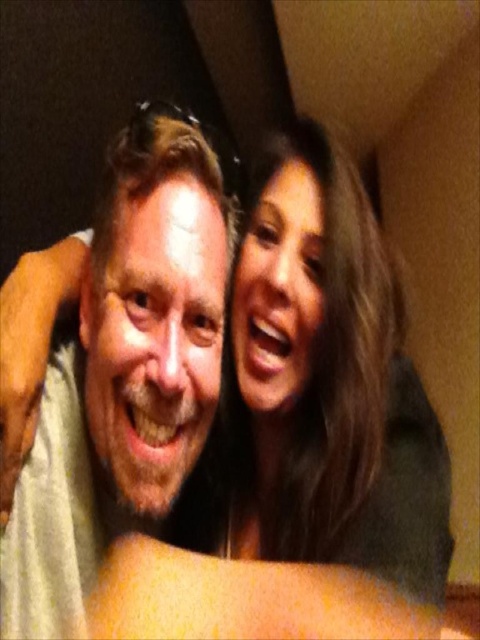
Between point (361, 330) and point (169, 262), which one is positioned in front?

Point (169, 262)

From the picture: Does smooth brown hair at upper right lie in front of white matte shirt at center?

No, smooth brown hair at upper right is behind white matte shirt at center.

Identify the location of smooth brown hair at upper right. Image resolution: width=480 pixels, height=640 pixels. (320, 388).